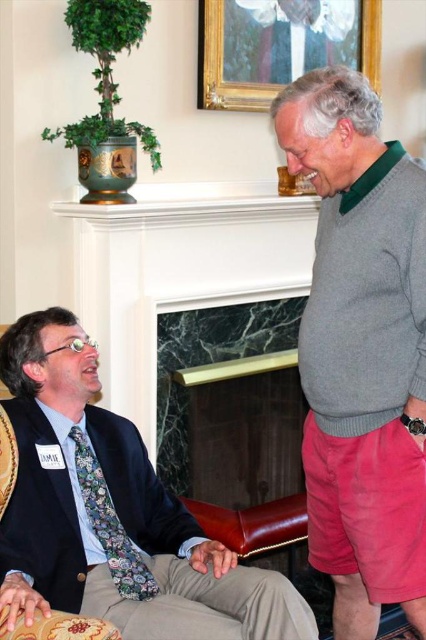
Question: Which object is closer to the camera taking this photo?

Choices:
 (A) floral tie at left
 (B) gold/gilded picture frame at upper center

Answer: (A)

Question: Which object appears closest to the camera in this image?

Choices:
 (A) floral tie at left
 (B) gold/gilded picture frame at upper center

Answer: (A)

Question: Can you confirm if floral tie at left is wider than gold/gilded picture frame at upper center?

Choices:
 (A) no
 (B) yes

Answer: (B)

Question: Can you confirm if knit gray sweater at right is smaller than floral tie at left?

Choices:
 (A) no
 (B) yes

Answer: (B)

Question: Based on their relative distances, which object is farther from the gold/gilded picture frame at upper center?

Choices:
 (A) knit gray sweater at right
 (B) floral tie at left

Answer: (B)

Question: Can you confirm if floral tie at left is wider than gold/gilded picture frame at upper center?

Choices:
 (A) no
 (B) yes

Answer: (B)